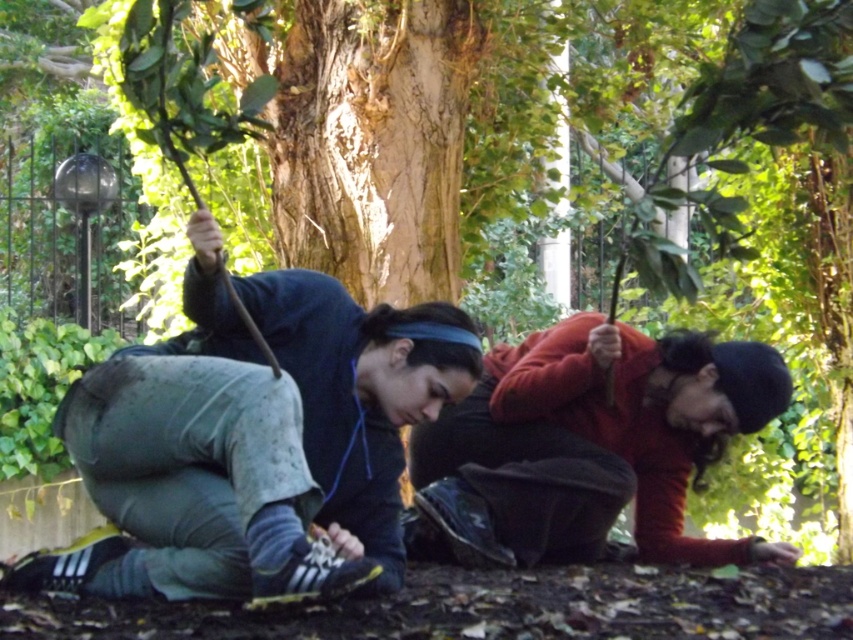
Question: Can you confirm if green camouflage pants at lower left is wider than red sweater at lower right?

Choices:
 (A) yes
 (B) no

Answer: (B)

Question: Can you confirm if green camouflage pants at lower left is bigger than red sweater at lower right?

Choices:
 (A) yes
 (B) no

Answer: (B)

Question: Is green camouflage pants at lower left positioned in front of red sweater at lower right?

Choices:
 (A) yes
 (B) no

Answer: (A)

Question: Which point appears closest to the camera in this image?

Choices:
 (A) (585, 493)
 (B) (276, 573)

Answer: (B)

Question: Which point is farther from the camera taking this photo?

Choices:
 (A) (140, 493)
 (B) (534, 336)

Answer: (B)